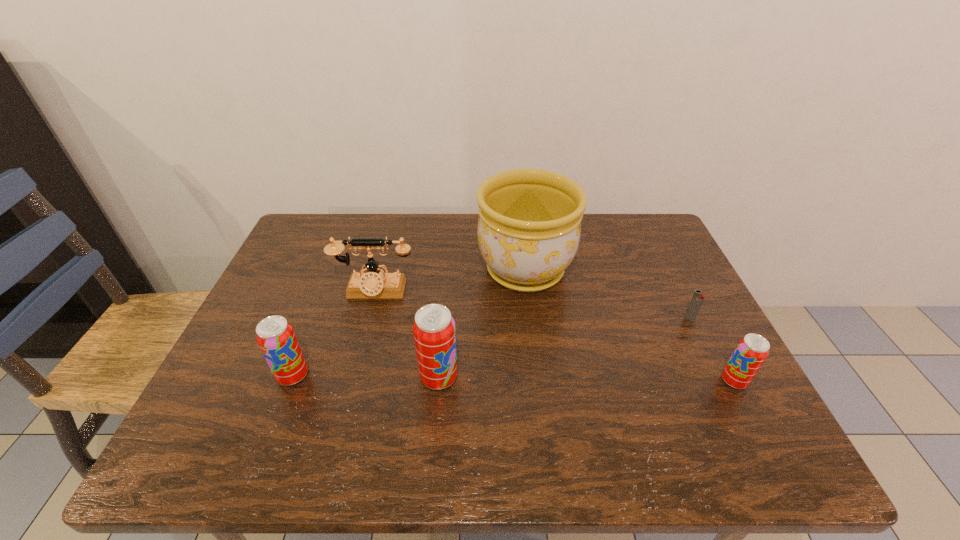
Locate an element on the screen. This screenshot has height=540, width=960. unoccupied area between the fourth object from left to right and the rightmost soda can is located at coordinates (630, 326).

Find the location of `free space between the second tallest soda can and the telephone`. free space between the second tallest soda can and the telephone is located at coordinates (334, 333).

This screenshot has width=960, height=540. What are the coordinates of `unoccupied position between the telephone and the shortest object` in the screenshot? It's located at (532, 305).

Where is `empty location between the flowerpot and the second soda can from right to left`? The width and height of the screenshot is (960, 540). empty location between the flowerpot and the second soda can from right to left is located at coordinates (482, 324).

At what (x,y) coordinates should I click in order to perform the action: click on vacant point located between the shortest object and the fourth object from left to right. Please return your answer as a coordinate pair (x, y). This screenshot has width=960, height=540. Looking at the image, I should click on (608, 294).

I want to click on unoccupied position between the third farthest object and the tallest object, so click(608, 294).

Image resolution: width=960 pixels, height=540 pixels. In order to click on free space between the igniter and the second soda can from left to right in this screenshot , I will do `click(564, 348)`.

This screenshot has height=540, width=960. I want to click on empty location between the fourth object from left to right and the tallest soda can, so click(x=482, y=324).

Locate an element on the screen. object that is the third closest to the tallest soda can is located at coordinates (276, 338).

The width and height of the screenshot is (960, 540). Find the location of `object that stands as the second closest to the flowerpot`. object that stands as the second closest to the flowerpot is located at coordinates (434, 332).